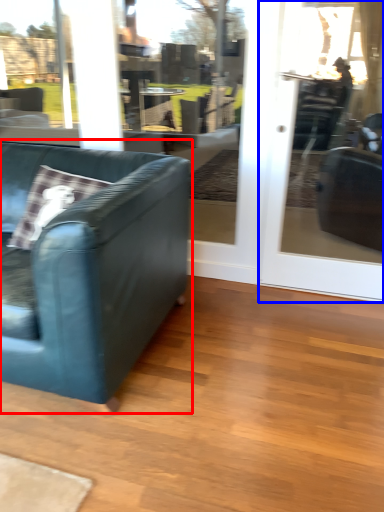
Question: Among these objects, which one is farthest to the camera, studio couch (highlighted by a red box) or screen door (highlighted by a blue box)?

Choices:
 (A) studio couch
 (B) screen door

Answer: (B)